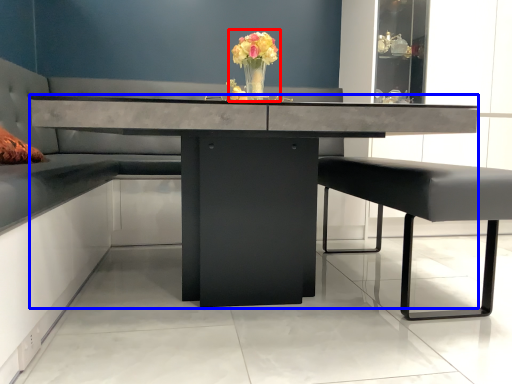
Question: Which point is closer to the camera, floral arrangement (highlighted by a red box) or table (highlighted by a blue box)?

Choices:
 (A) floral arrangement
 (B) table

Answer: (B)